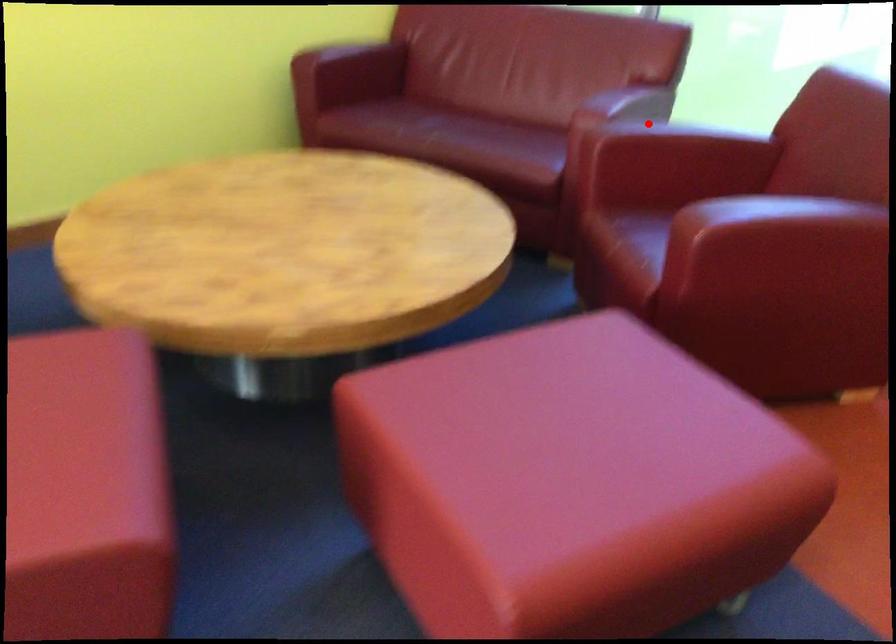
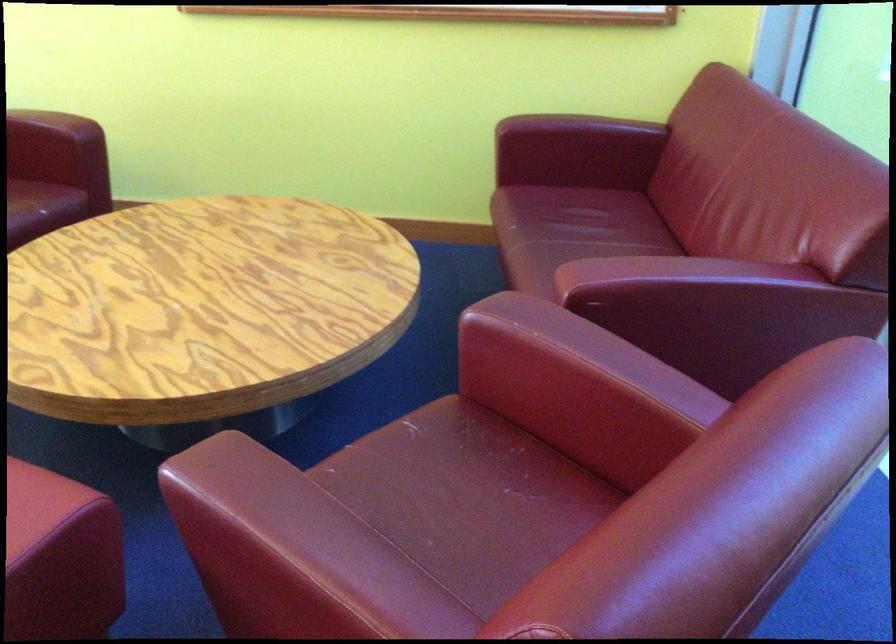
Find the pixel in the second image that matches the highlighted location in the first image.

(540, 319)